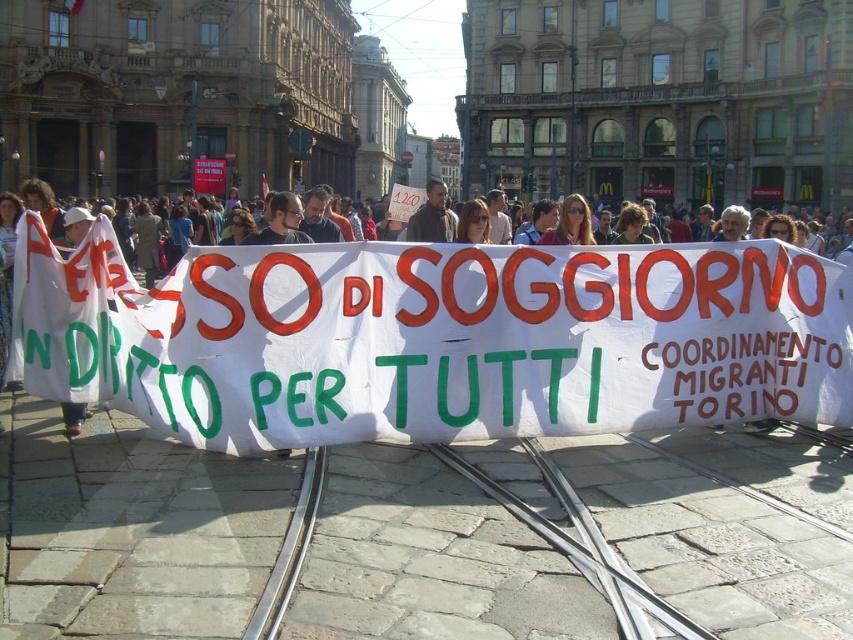
You are a photographer standing at the edge of the square. You want to take a photo that includes both the white paper banner at center and the matte black sign at center. What is the minimum distance you need to move backward to ensure both objects are in frame?

The distance between the white paper banner at center and matte black sign at center is 39.34 feet. To include both in the frame, you need to move back at least half of that distance, so approximately 19.67 feet backward.